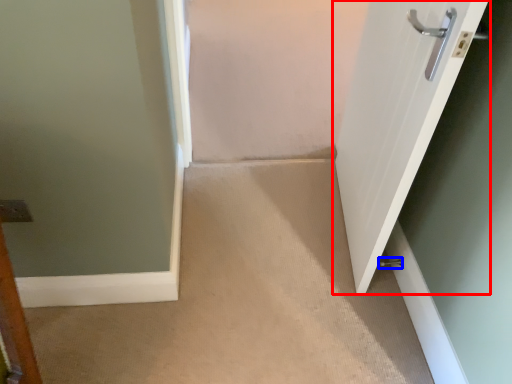
Question: Which object appears closest to the camera in this image, door (highlighted by a red box) or door handle (highlighted by a blue box)?

Choices:
 (A) door
 (B) door handle

Answer: (A)